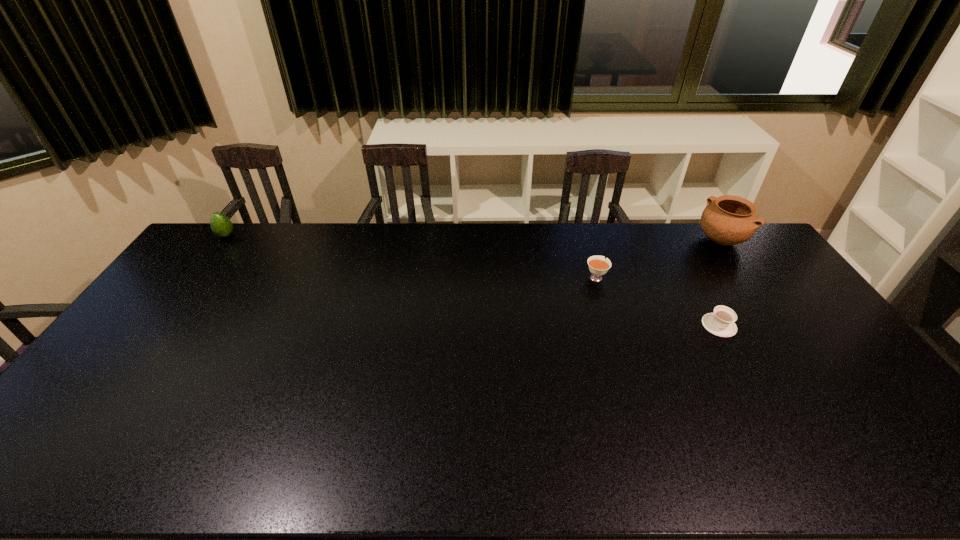
At what (x,y) coordinates should I click in order to perform the action: click on blank region between the avocado and the third object from right to left. Please return your answer as a coordinate pair (x, y). Looking at the image, I should click on (411, 256).

The height and width of the screenshot is (540, 960). I want to click on vacant space that's between the third shortest object and the pottery, so click(x=473, y=238).

Locate an element on the screen. free area in between the pottery and the left teacup is located at coordinates (x=658, y=258).

Where is `free space between the third object from left to right and the second nearest object`? Image resolution: width=960 pixels, height=540 pixels. free space between the third object from left to right and the second nearest object is located at coordinates (658, 301).

The image size is (960, 540). Find the location of `free space between the pottery and the avocado`. free space between the pottery and the avocado is located at coordinates (473, 238).

I want to click on free space between the pottery and the leftmost object, so click(x=473, y=238).

Select which object is the closest to the avocado. Please provide its 2D coordinates. Your answer should be formatted as a tuple, i.e. [(x, y)], where the tuple contains the x and y coordinates of a point satisfying the conditions above.

[(598, 265)]

Locate which object ranks second in proximity to the second object from left to right. Please provide its 2D coordinates. Your answer should be formatted as a tuple, i.e. [(x, y)], where the tuple contains the x and y coordinates of a point satisfying the conditions above.

[(727, 220)]

Locate an element on the screen. This screenshot has height=540, width=960. blank space that satisfies the following two spatial constraints: 1. on the handle side of the nearer teacup; 2. on the right side of the tallest object is located at coordinates (672, 240).

At what (x,y) coordinates should I click in order to perform the action: click on blank area in the image that satisfies the following two spatial constraints: 1. on the handle side of the tallest object; 2. on the left side of the third object from left to right. Please return your answer as a coordinate pair (x, y). Looking at the image, I should click on tap(672, 240).